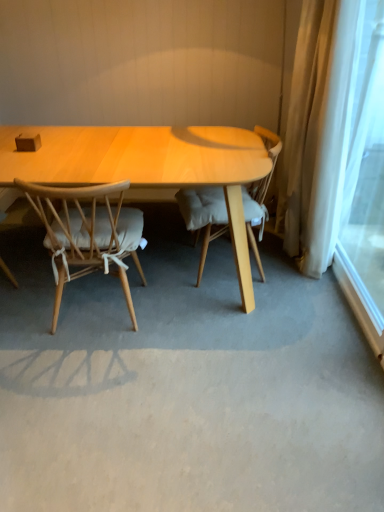
Find the location of a particular element. The width and height of the screenshot is (384, 512). vacant area located to the right-hand side of light brown wood chair at center, marked as the 1th chair in a right-to-left arrangement is located at coordinates (300, 289).